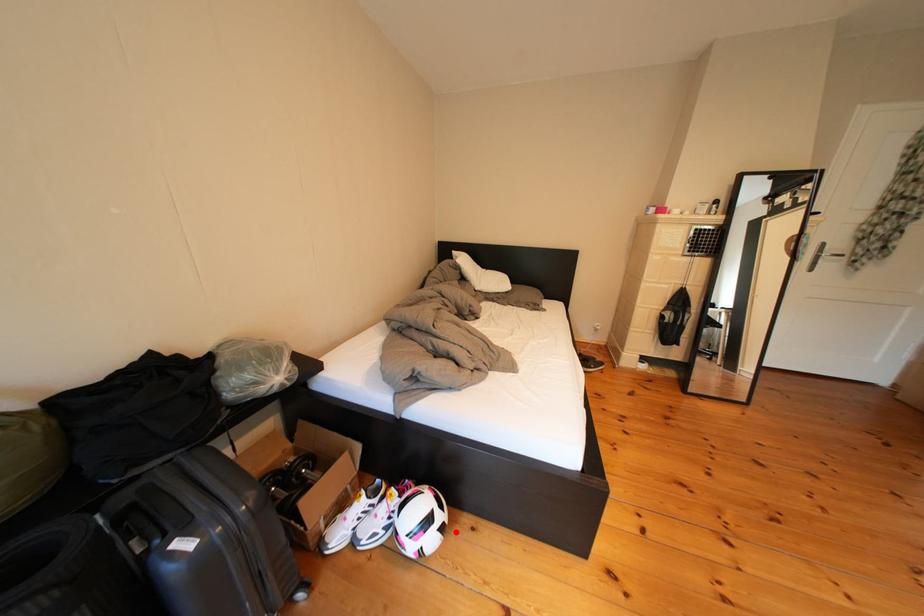
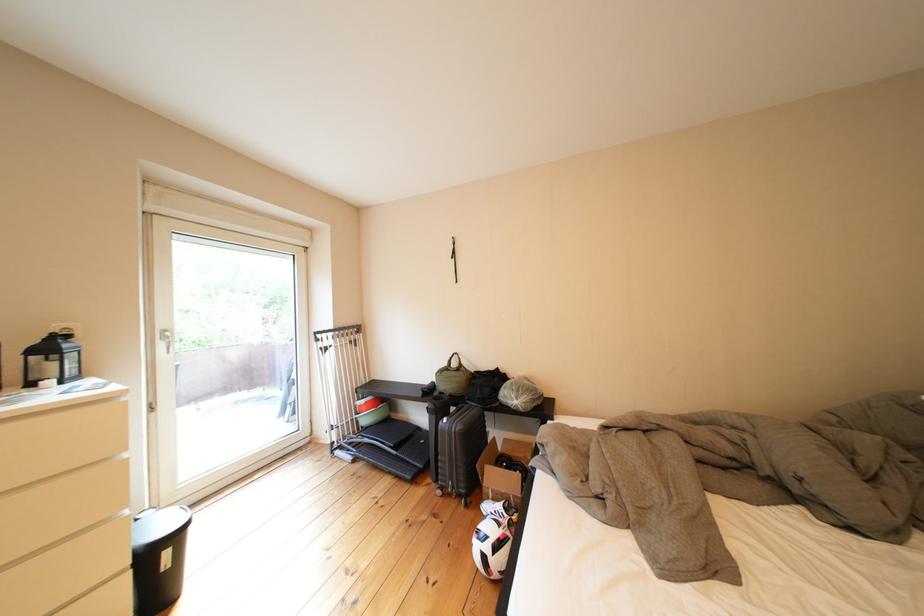
The point at the highlighted location is marked in the first image. Where is the corresponding point in the second image?

(499, 562)